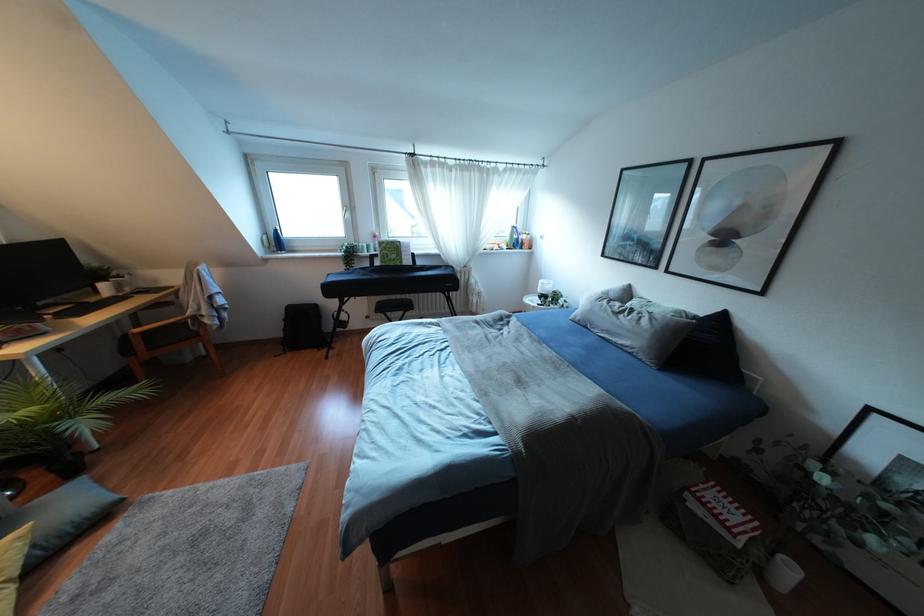
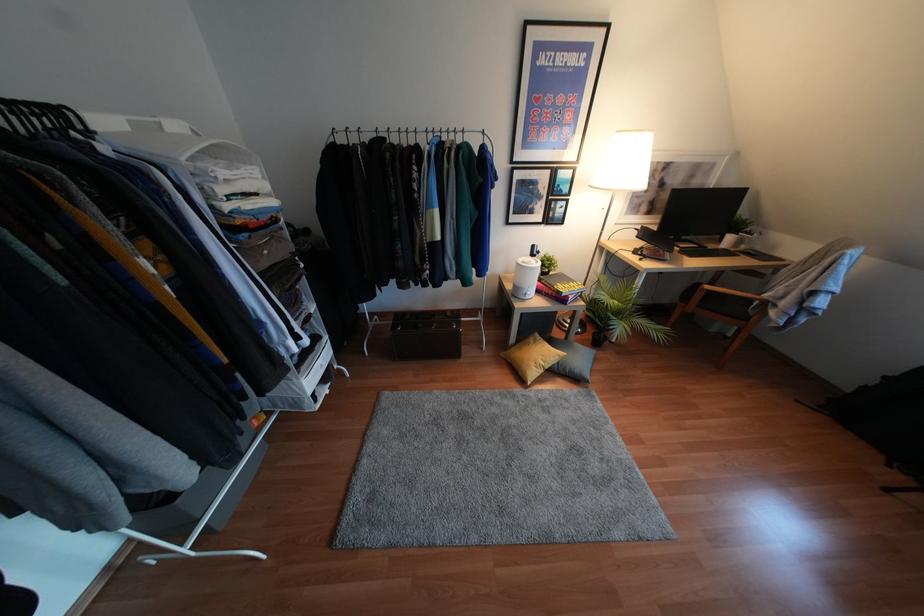
Where in the second image is the point corresponding to point (196, 334) from the first image?

(745, 318)